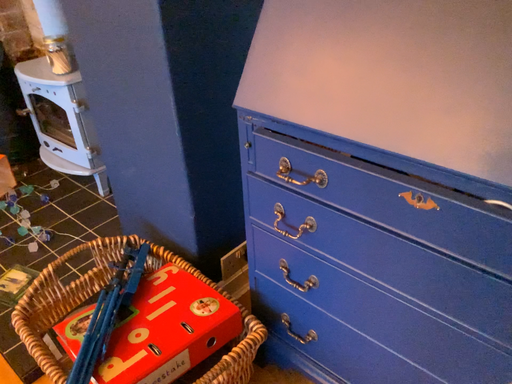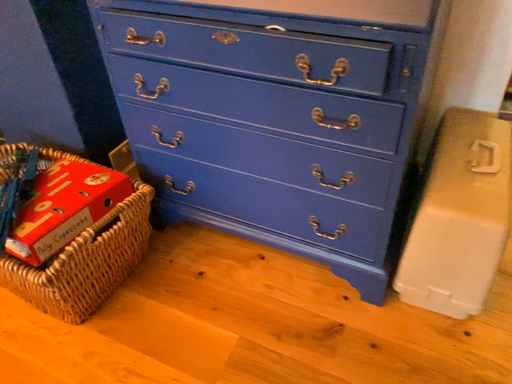
Question: How did the camera likely rotate when shooting the video?

Choices:
 (A) rotated upward
 (B) rotated downward

Answer: (B)